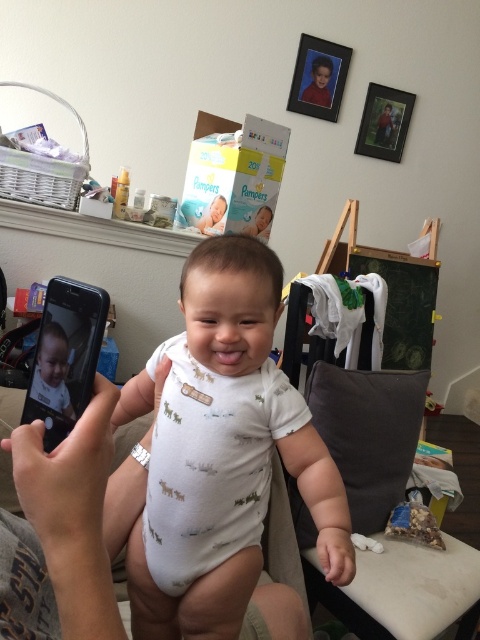
You are a photographer setting up for a baby photoshoot. You need to ensure the white soft onesie at center is visible above the gray fabric armchair at lower right. Based on the scene, will the onesie be visible over the armchair?

The white soft onesie at center has a greater height compared to gray fabric armchair at lower right, so yes, the onesie will be visible above the armchair.

Based on the photo, you are standing 40 inches away from the point marked as point (167, 604). Can you reach it without moving closer?

The distance of point (167, 604) from viewer is 38.83 inches, so yes, you can reach it without moving closer because you are 40 inches away, which is slightly farther than the point.